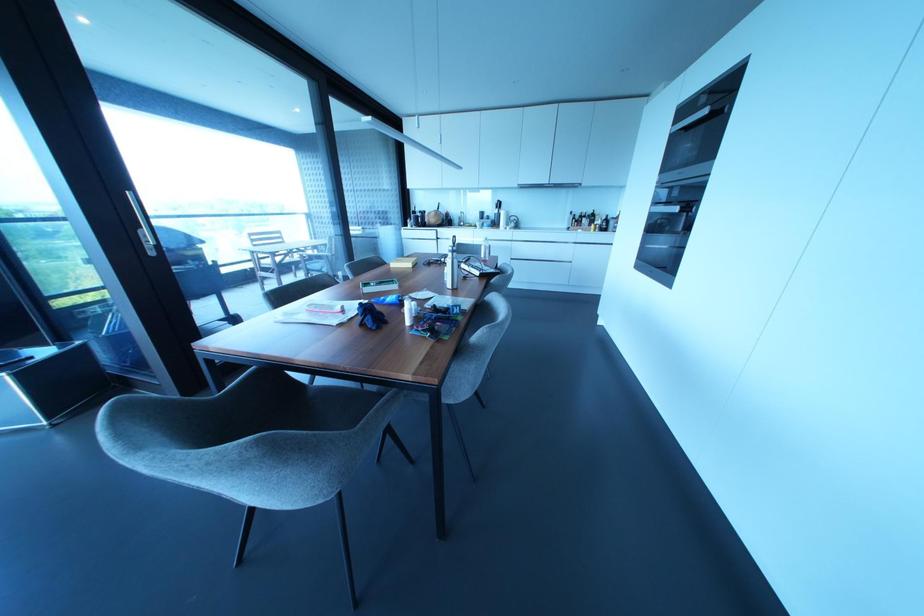
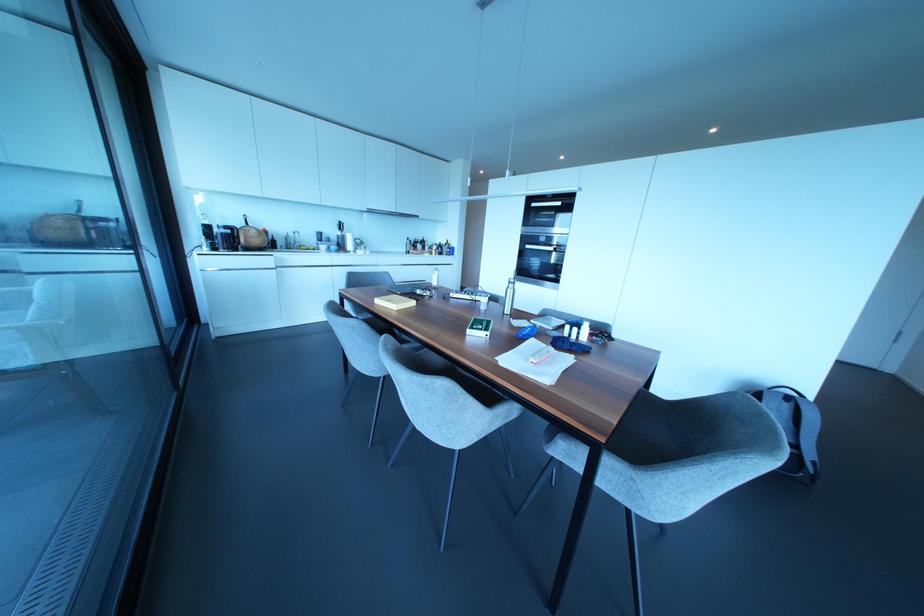
The point at (481,256) is marked in the first image. Where is the corresponding point in the second image?

(434, 283)